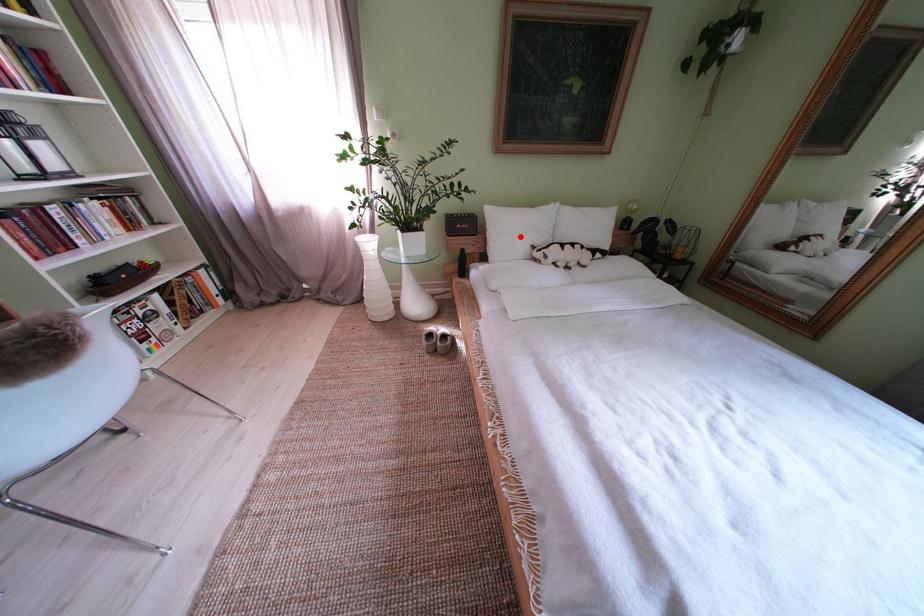
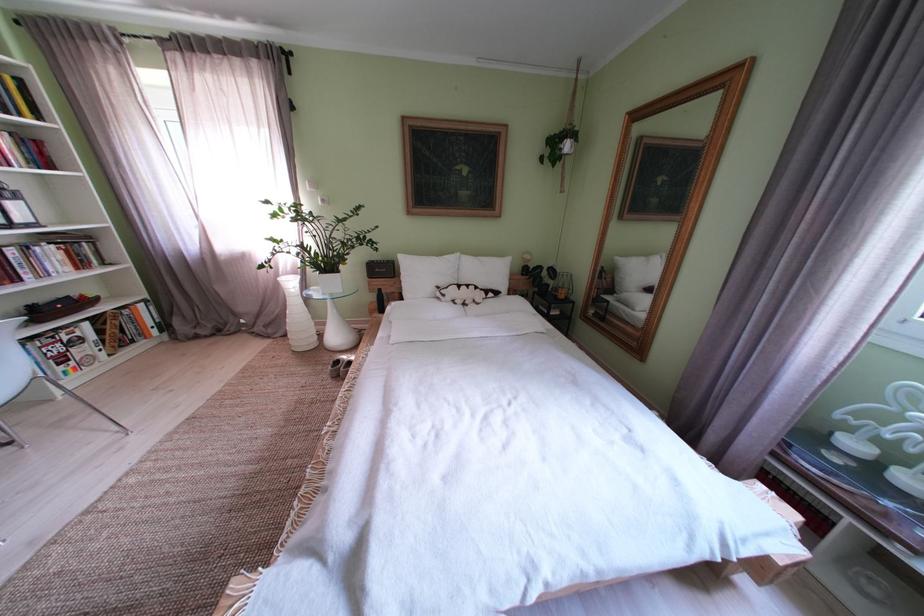
In the second image, find the point that corresponds to the highlighted location in the first image.

(429, 280)